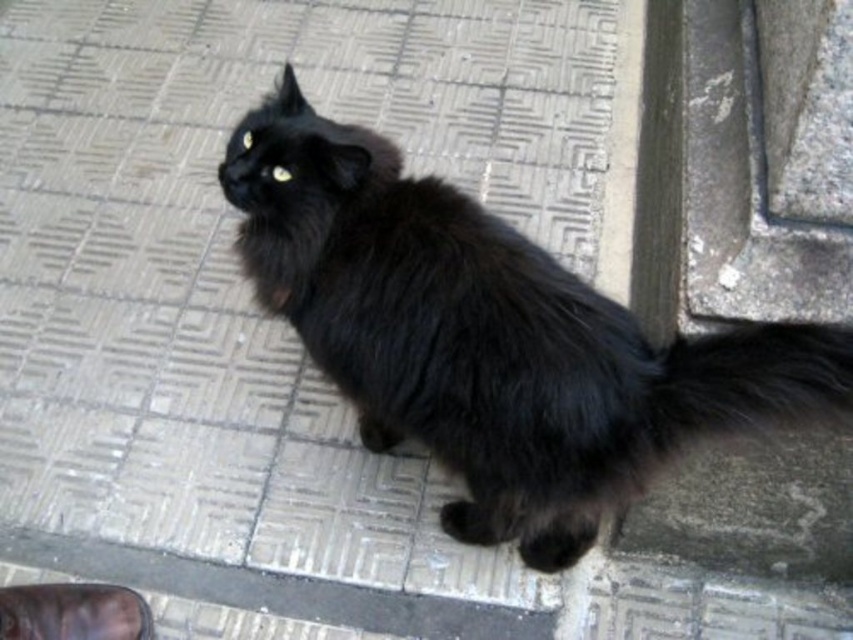
This screenshot has width=853, height=640. What are the coordinates of `black fluffy tail at lower right` in the screenshot? It's located at (751, 380).

Is point (796, 337) farther from viewer compared to point (6, 614)?

No, (796, 337) is closer to viewer.

Is point (744, 422) closer to viewer compared to point (152, 634)?

Yes, point (744, 422) is closer to viewer.

This screenshot has width=853, height=640. In order to click on black fluffy tail at lower right in this screenshot , I will do `click(751, 380)`.

Is black fluffy cat at center above black fluffy tail at lower right?

Actually, black fluffy cat at center is below black fluffy tail at lower right.

Who is positioned more to the right, black fluffy cat at center or black fluffy tail at lower right?

black fluffy tail at lower right

Which is in front, point (405, 292) or point (779, 392)?

Point (779, 392)

Identify the location of black fluffy cat at center. (489, 337).

Does black fluffy cat at center appear on the left side of leather shoe at lower left?

No, black fluffy cat at center is not to the left of leather shoe at lower left.

Which is behind, point (376, 205) or point (39, 632)?

The point (39, 632) is behind.

Locate an element on the screen. The width and height of the screenshot is (853, 640). black fluffy cat at center is located at coordinates (489, 337).